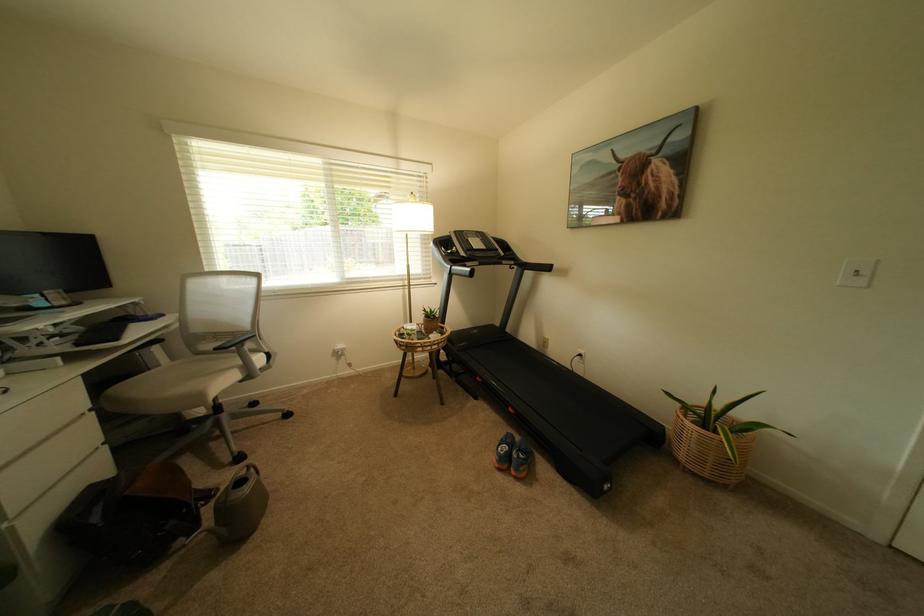
You are a GUI agent. You are given a task and a screenshot of the screen. Output one action in this format:
    pyautogui.click(x=<x>, y=<y>)
    Task: Click on the white drawer handle
    This screenshot has height=616, width=924.
    Given the screenshot: What is the action you would take?
    pyautogui.click(x=70, y=422)